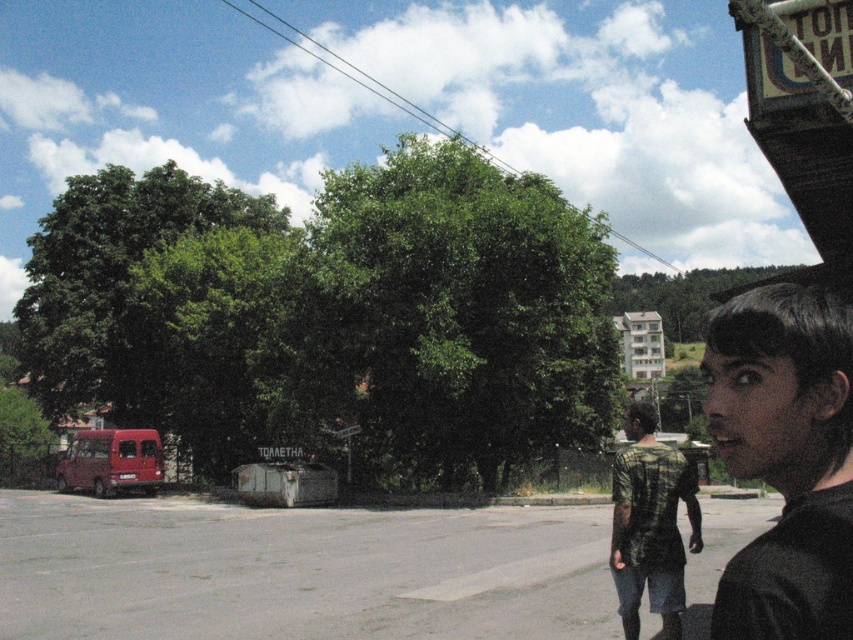
Question: Which point is farther to the camera?

Choices:
 (A) (668, 493)
 (B) (787, 324)

Answer: (A)

Question: Can you confirm if black matte face at right is positioned to the right of camo-patterned shirt at center?

Choices:
 (A) yes
 (B) no

Answer: (B)

Question: Is black matte face at right positioned before camo-patterned shirt at center?

Choices:
 (A) yes
 (B) no

Answer: (A)

Question: Among these objects, which one is farthest from the camera?

Choices:
 (A) black matte face at right
 (B) camo-patterned shirt at center

Answer: (B)

Question: Does black matte face at right appear on the right side of camo-patterned shirt at center?

Choices:
 (A) no
 (B) yes

Answer: (A)

Question: Which object is farther from the camera taking this photo?

Choices:
 (A) camo-patterned shirt at center
 (B) black matte face at right

Answer: (A)